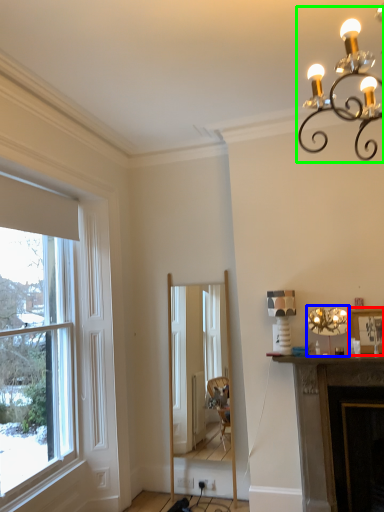
Question: Estimate the real-world distances between objects in this image. Which object is closer to picture frame (highlighted by a red box), lamp (highlighted by a blue box) or light fixture (highlighted by a green box)?

Choices:
 (A) lamp
 (B) light fixture

Answer: (A)